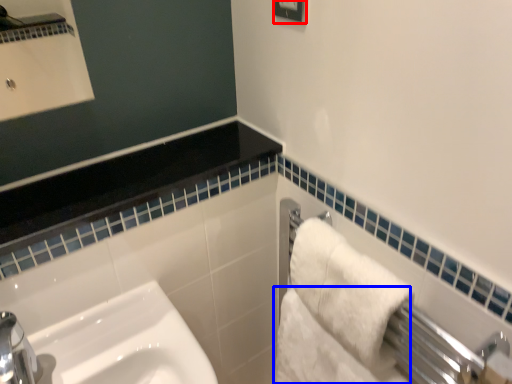
Question: Which point is closer to the camera, square (highlighted by a red box) or bath towel (highlighted by a blue box)?

Choices:
 (A) square
 (B) bath towel

Answer: (A)